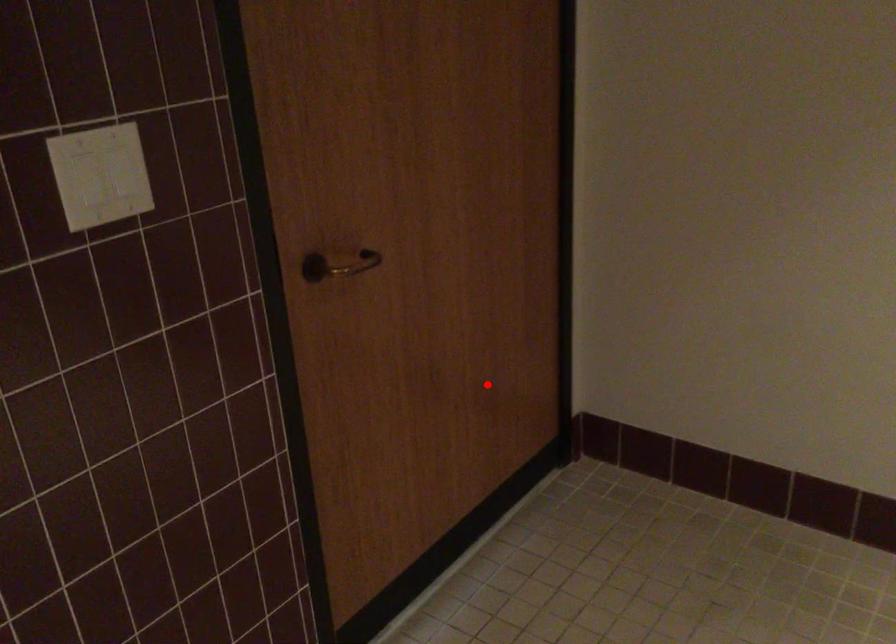
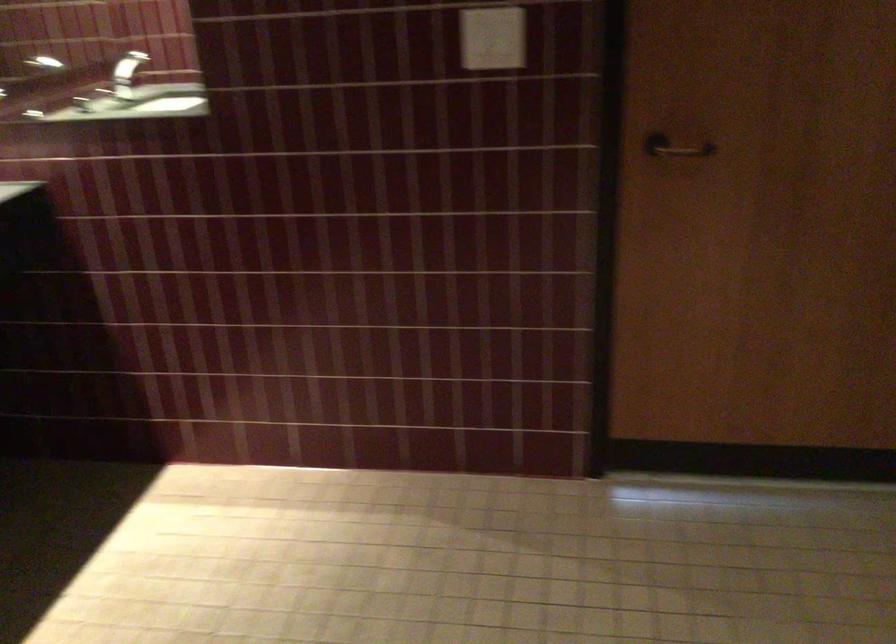
Locate, in the second image, the point that corresponds to the highlighted location in the first image.

(857, 321)